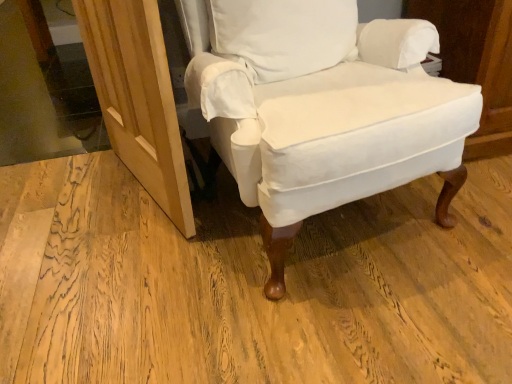
I want to click on free spot in front of white cotton chair at center, so click(310, 315).